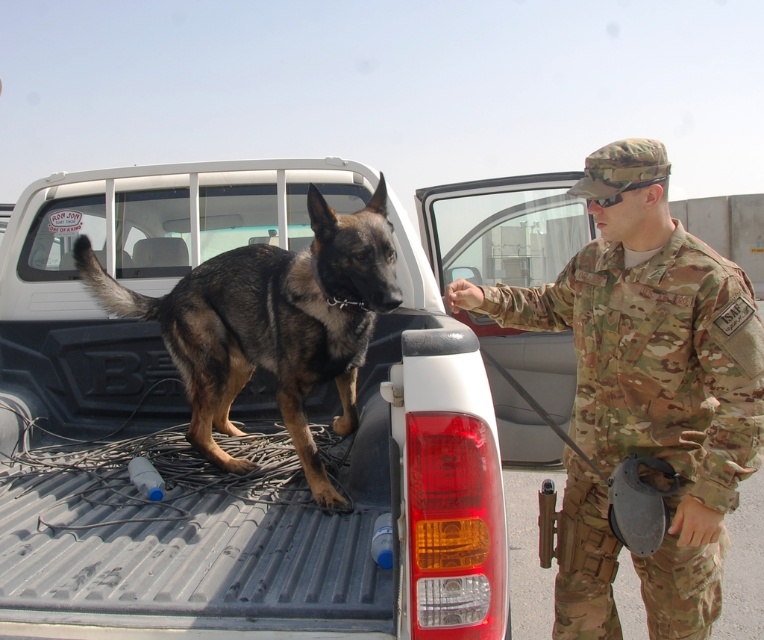
Question: Does camouflage uniform at center lie in front of brown fur dog at center?

Choices:
 (A) no
 (B) yes

Answer: (B)

Question: Among these objects, which one is farthest from the camera?

Choices:
 (A) brown fur dog at center
 (B) camouflage uniform at center

Answer: (A)

Question: Which point is closer to the camera taking this photo?

Choices:
 (A) (245, 291)
 (B) (649, 310)

Answer: (B)

Question: Which point appears farthest from the camera in this image?

Choices:
 (A) (180, 346)
 (B) (720, 512)

Answer: (A)

Question: Is camouflage uniform at center to the left of brown fur dog at center from the viewer's perspective?

Choices:
 (A) yes
 (B) no

Answer: (B)

Question: Does camouflage uniform at center appear over brown fur dog at center?

Choices:
 (A) yes
 (B) no

Answer: (B)